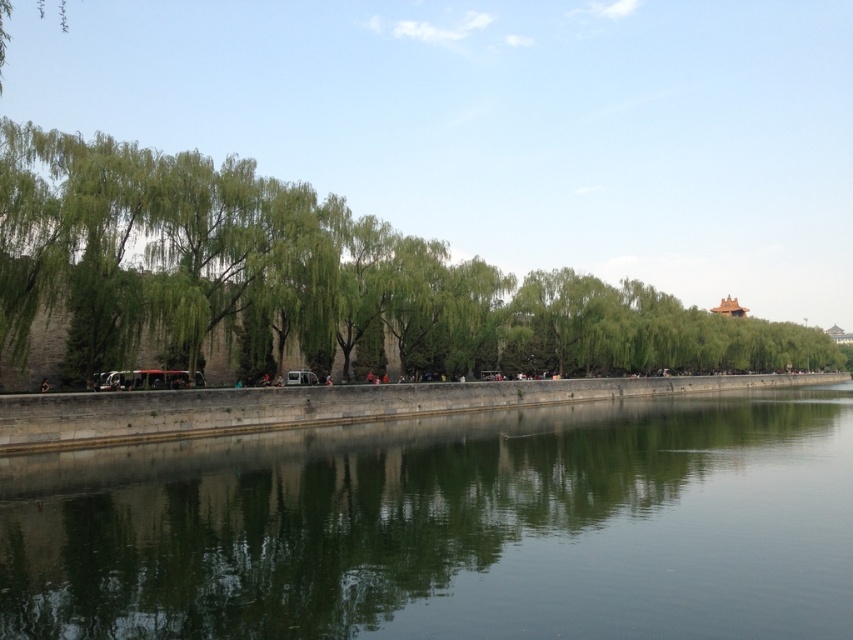
Is green stone wall at lower center to the right of green leafy tree at left from the viewer's perspective?

No, green stone wall at lower center is not to the right of green leafy tree at left.

Between point (572, 538) and point (720, 336), which one is positioned in front?

Point (572, 538) is more forward.

Find the location of `green stone wall at lower center`. green stone wall at lower center is located at coordinates (450, 528).